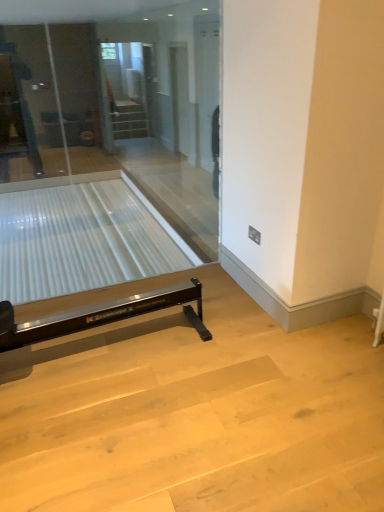
Question: From a real-world perspective, is clear glass screen door at upper center located beneath clear glass table at lower left?

Choices:
 (A) yes
 (B) no

Answer: (B)

Question: Considering the relative sizes of clear glass screen door at upper center and clear glass table at lower left in the image provided, is clear glass screen door at upper center thinner than clear glass table at lower left?

Choices:
 (A) yes
 (B) no

Answer: (A)

Question: Considering the relative sizes of clear glass screen door at upper center and clear glass table at lower left in the image provided, is clear glass screen door at upper center bigger than clear glass table at lower left?

Choices:
 (A) no
 (B) yes

Answer: (A)

Question: Is clear glass screen door at upper center oriented towards clear glass table at lower left?

Choices:
 (A) no
 (B) yes

Answer: (A)

Question: Would you say clear glass screen door at upper center contains clear glass table at lower left?

Choices:
 (A) yes
 (B) no

Answer: (B)

Question: Is point (77, 192) positioned closer to the camera than point (210, 152)?

Choices:
 (A) closer
 (B) farther

Answer: (B)

Question: Is clear glass table at lower left taller or shorter than transparent glass door at center?

Choices:
 (A) tall
 (B) short

Answer: (B)

Question: Considering the positions of clear glass table at lower left and transparent glass door at center in the image, is clear glass table at lower left wider or thinner than transparent glass door at center?

Choices:
 (A) wide
 (B) thin

Answer: (A)

Question: Based on their sizes in the image, would you say clear glass table at lower left is bigger or smaller than transparent glass door at center?

Choices:
 (A) small
 (B) big

Answer: (B)

Question: Considering their positions, is transparent glass door at center located in front of or behind clear glass table at lower left?

Choices:
 (A) behind
 (B) front

Answer: (B)

Question: Would you say transparent glass door at center is to the left or to the right of clear glass table at lower left in the picture?

Choices:
 (A) left
 (B) right

Answer: (B)

Question: From a real-world perspective, relative to clear glass table at lower left, is transparent glass door at center vertically above or below?

Choices:
 (A) below
 (B) above

Answer: (B)

Question: From the image's perspective, is transparent glass door at center located above or below clear glass table at lower left?

Choices:
 (A) below
 (B) above

Answer: (B)

Question: Based on their positions, is clear glass table at lower left located to the left or right of clear glass screen door at upper center?

Choices:
 (A) right
 (B) left

Answer: (B)

Question: Is clear glass table at lower left taller or shorter than clear glass screen door at upper center?

Choices:
 (A) short
 (B) tall

Answer: (A)